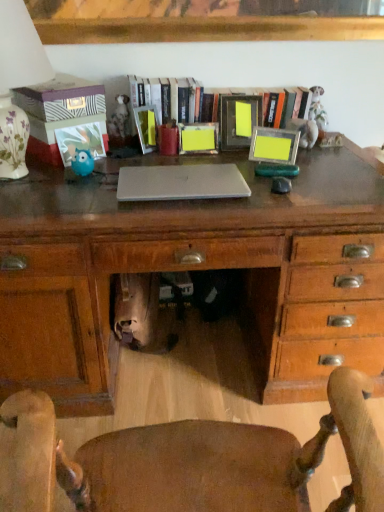
Locate an element on the screen. This screenshot has height=512, width=384. free space in front of satin silver laptop at center is located at coordinates (172, 212).